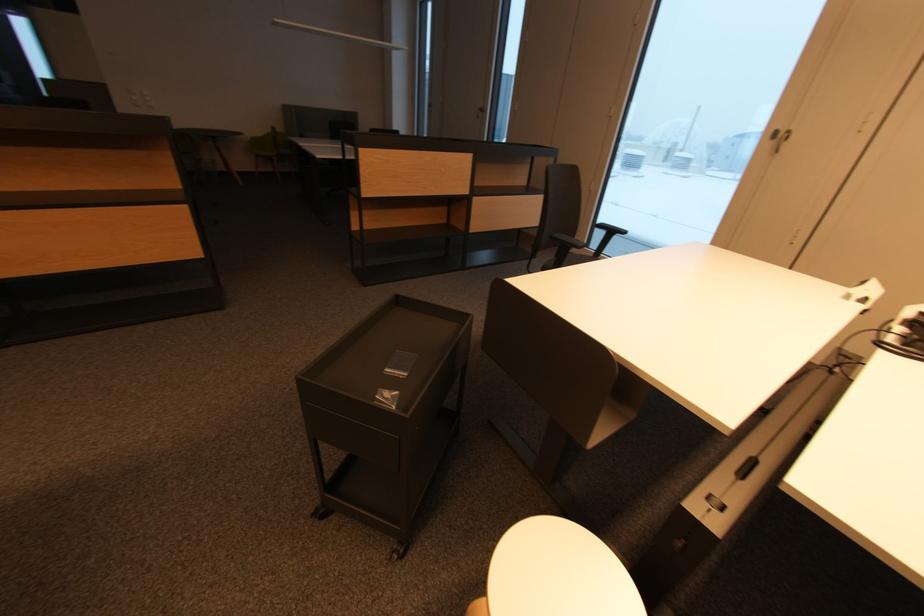
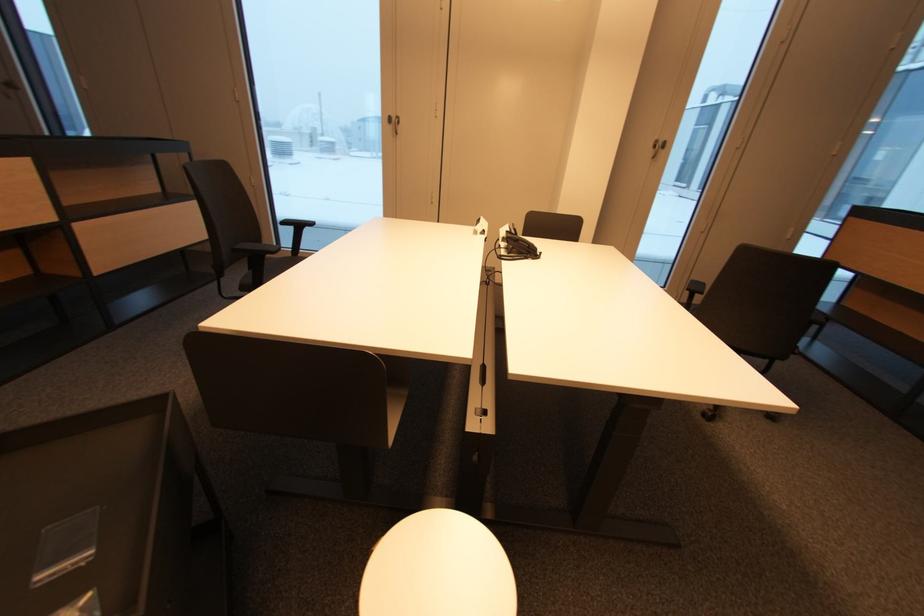
Question: Based on the continuous images, in which direction is the camera rotating? Reply with the corresponding letter.

Choices:
 (A) Left
 (B) Right
 (C) Up
 (D) Down

Answer: (B)